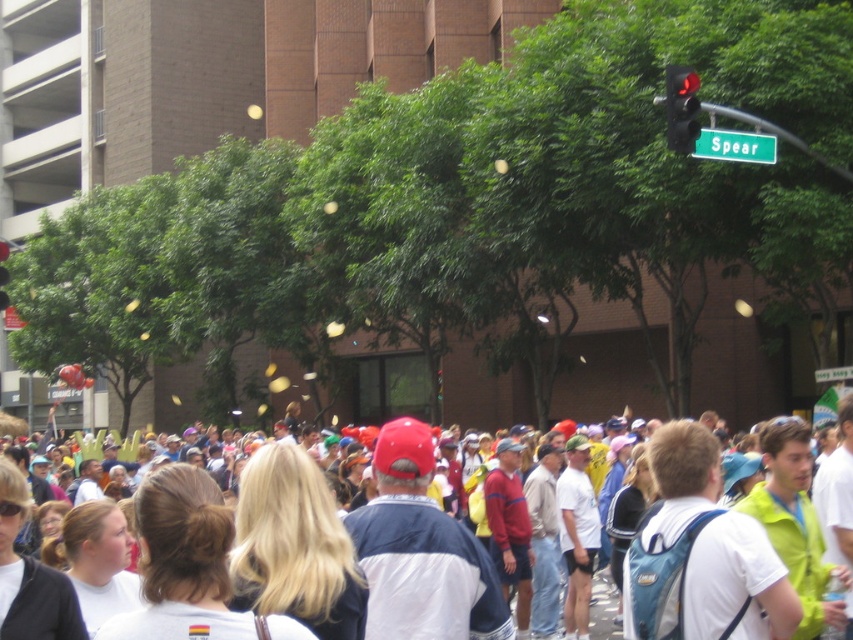
Between point (683, 140) and point (22, 420), which one is positioned behind?

The point (22, 420) is behind.

Does red glass traffic light at upper right have a greater width compared to white cotton crowd at center?

In fact, red glass traffic light at upper right might be narrower than white cotton crowd at center.

Does point (672, 115) come behind point (596, 579)?

That is False.

Where is `red glass traffic light at upper right`? The image size is (853, 640). red glass traffic light at upper right is located at coordinates pos(682,108).

Measure the distance between red glass traffic light at upper right and metallic red traffic light at upper right.

A distance of 67.80 feet exists between red glass traffic light at upper right and metallic red traffic light at upper right.

Who is more distant from viewer, (691, 122) or (7, 275)?

The point (7, 275) is more distant.

Between point (693, 109) and point (6, 272), which one is positioned in front?

Point (693, 109)

Find the location of a particular element. The height and width of the screenshot is (640, 853). red glass traffic light at upper right is located at coordinates (682, 108).

The height and width of the screenshot is (640, 853). What do you see at coordinates (602, 614) in the screenshot?
I see `white cotton crowd at center` at bounding box center [602, 614].

Is white cotton crowd at center above metallic red traffic light at upper right?

No.

From the picture: Who is more forward, (x=598, y=624) or (x=9, y=252)?

Point (x=598, y=624)

Locate an element on the screen. This screenshot has height=640, width=853. white cotton crowd at center is located at coordinates (602, 614).